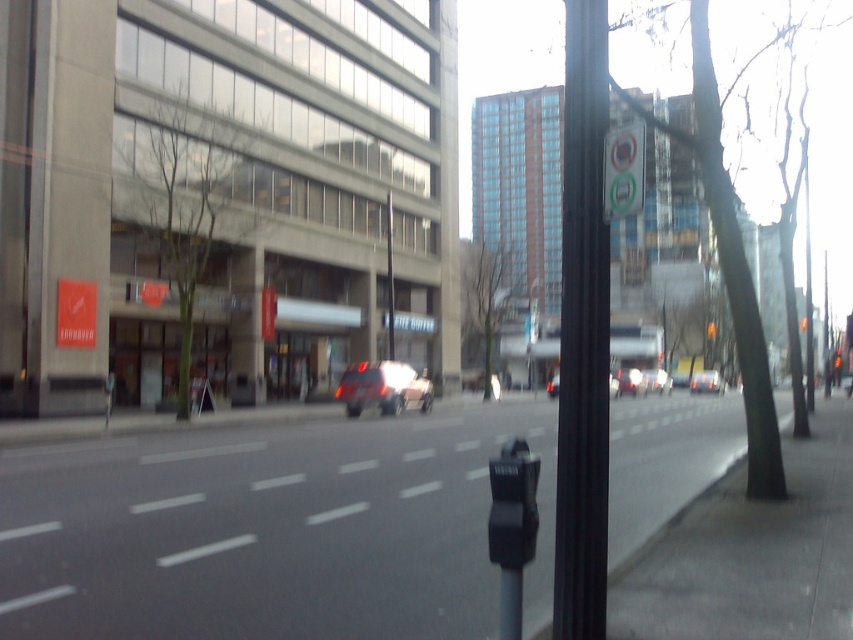
You are a delivery person needing to park your 2.5 meter wide van in this urban street scene. The parking spot is between the metallic silver car at center and the matte red suv at center. Can your van fit in the space between them?

The metallic silver car at center is narrower than the matte red suv at center. Since the van is 2.5 meters wide, and the space between them is determined by the width of the cars, the van might fit if the total available space is at least 2.5 meters. However, without exact measurements, it is uncertain. Consider checking the space more carefully.

You are a pedestrian standing on the sidewalk looking at the urban street scene. There are two points marked on the image, one at coordinates point (x=18, y=531) and the other at point (x=410, y=372). Which of these two points is nearer to you?

Point (x=18, y=531) is closer to the viewer than point (x=410, y=372).

You are standing at the parking meter mounted on a dark colored pole in the foreground of the urban street scene. You want to reach a point that is 3.76 meters away from your current position. Can you estimate whether the point at coordinates (529, 548) is within that distance?

The distance of point (529, 548) from camera is 3.76 meters, so yes, the point at coordinates (529, 548) is exactly 3.76 meters away from your current position at the parking meter mounted on a dark colored pole.